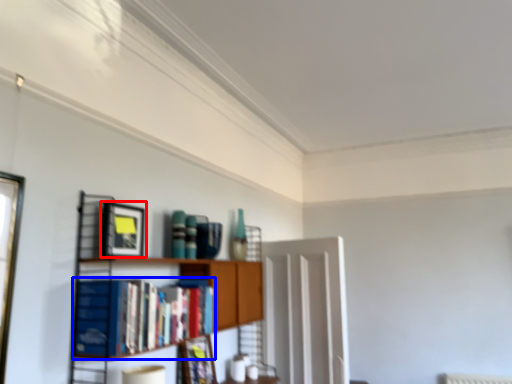
Question: Which point is closer to the camera, picture frame (highlighted by a red box) or book (highlighted by a blue box)?

Choices:
 (A) picture frame
 (B) book

Answer: (B)